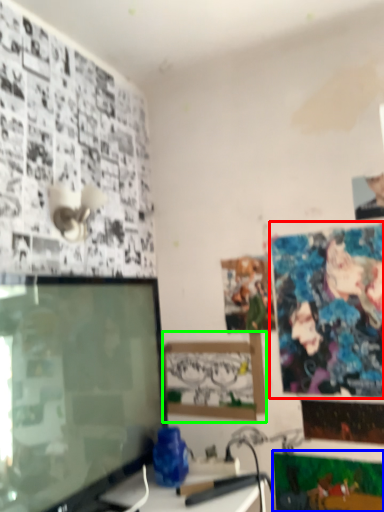
Question: Which is nearer to the poster page (highlighted by a red box)? poster page (highlighted by a blue box) or picture frame (highlighted by a green box).

Choices:
 (A) poster page
 (B) picture frame

Answer: (B)